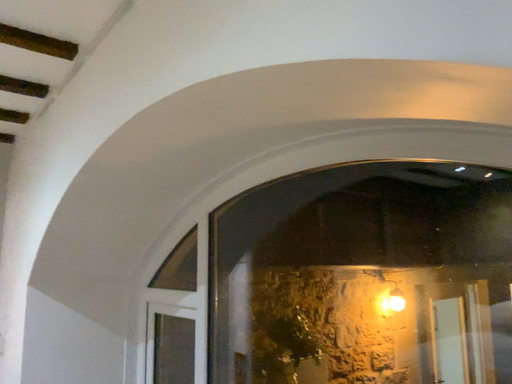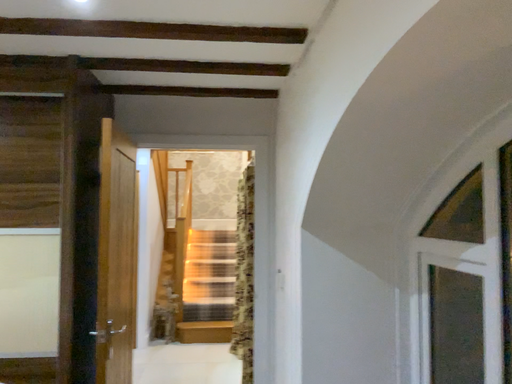
Question: How did the camera likely rotate when shooting the video?

Choices:
 (A) rotated upward
 (B) rotated downward

Answer: (B)